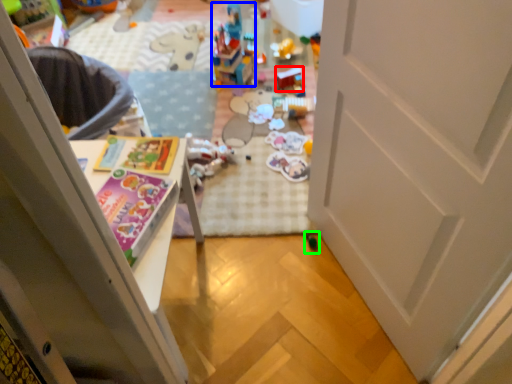
Question: Which object is the closest to the toy (highlighted by a red box)? Choose among these: toy (highlighted by a blue box) or toy (highlighted by a green box).

Choices:
 (A) toy
 (B) toy

Answer: (A)